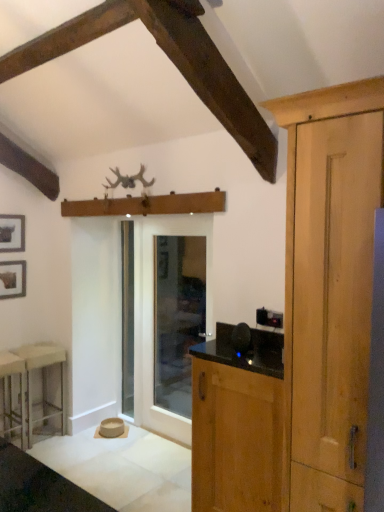
The image size is (384, 512). Identify the location of vacant point above clear glass door at center, the 2th screen door when ordered from left to right (from a real-world perspective). (167, 216).